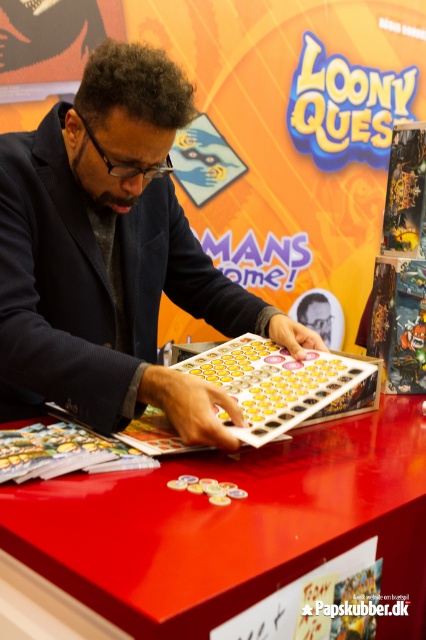
Question: Which object is closer to the camera taking this photo?

Choices:
 (A) matte black suit at center
 (B) shiny plastic board game at center

Answer: (B)

Question: Can you confirm if matte black suit at center is positioned above shiny plastic board game at center?

Choices:
 (A) no
 (B) yes

Answer: (B)

Question: Which point appears farthest from the camera in this image?

Choices:
 (A) (324, 397)
 (B) (92, 266)

Answer: (B)

Question: Can you confirm if matte black suit at center is positioned to the left of shiny plastic board game at center?

Choices:
 (A) no
 (B) yes

Answer: (B)

Question: Can you confirm if matte black suit at center is bigger than shiny plastic board game at center?

Choices:
 (A) no
 (B) yes

Answer: (B)